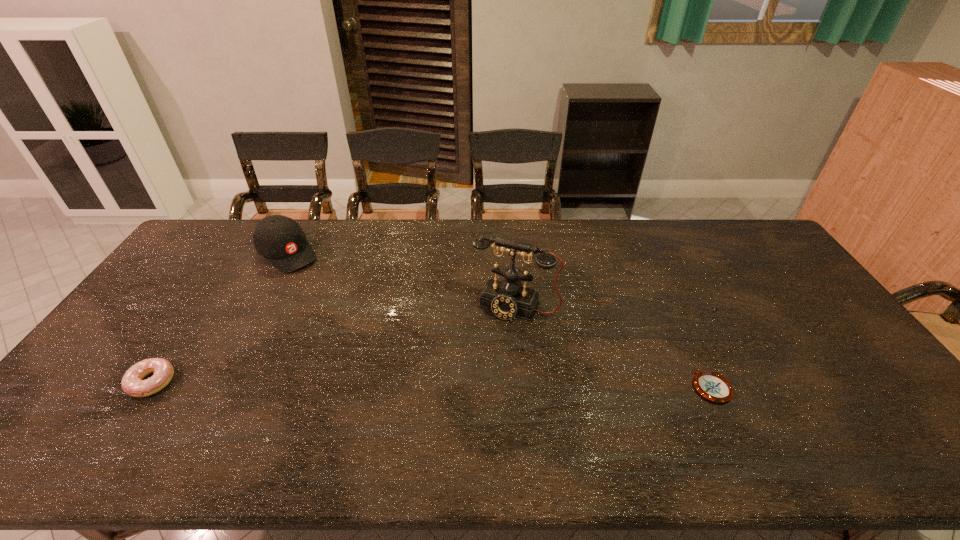
Identify the location of free space on the desktop that is between the doughnut and the compass and is positioned on the dial of the tallest object. (477, 385).

You are a GUI agent. You are given a task and a screenshot of the screen. Output one action in this format:
    pyautogui.click(x=<x>, y=<y>)
    Task: Click on the free space on the desktop that is between the third tallest object and the compass and is positioned with a logo on the front of the third object from right to left
    The image size is (960, 540).
    Given the screenshot: What is the action you would take?
    pyautogui.click(x=431, y=384)